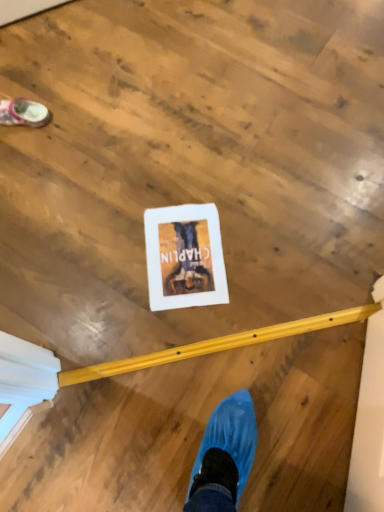
Where is `vacant space that is to the left of white paper at center`? This screenshot has width=384, height=512. vacant space that is to the left of white paper at center is located at coordinates (103, 262).